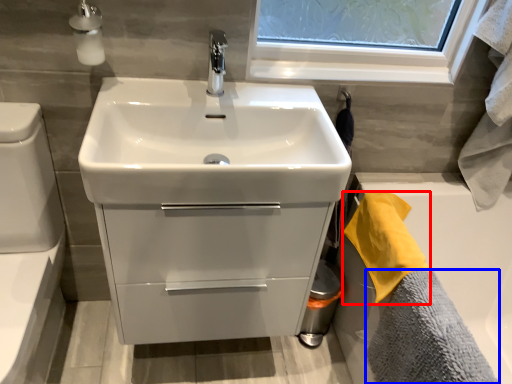
Question: Which of the following is the farthest to the observer, bath towel (highlighted by a red box) or bath towel (highlighted by a blue box)?

Choices:
 (A) bath towel
 (B) bath towel

Answer: (A)